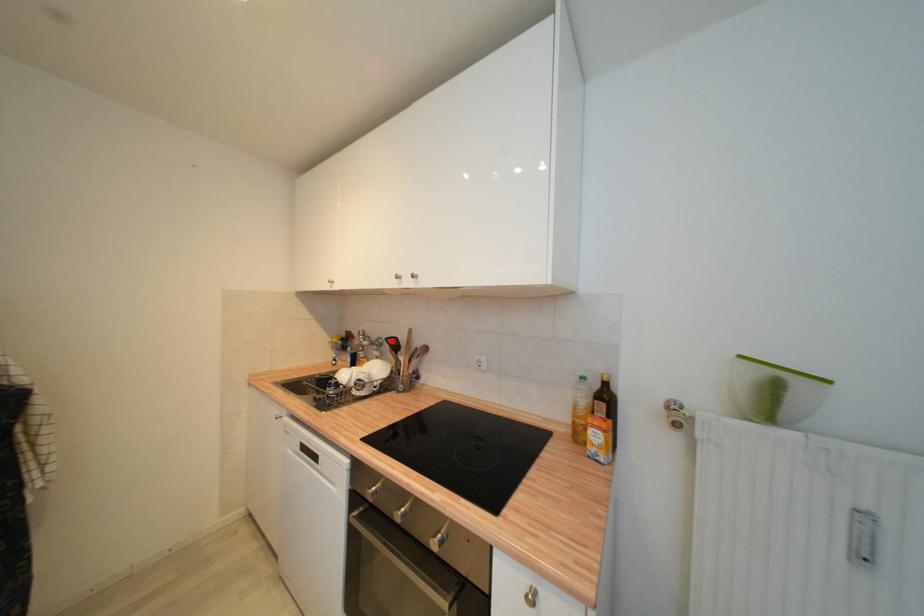
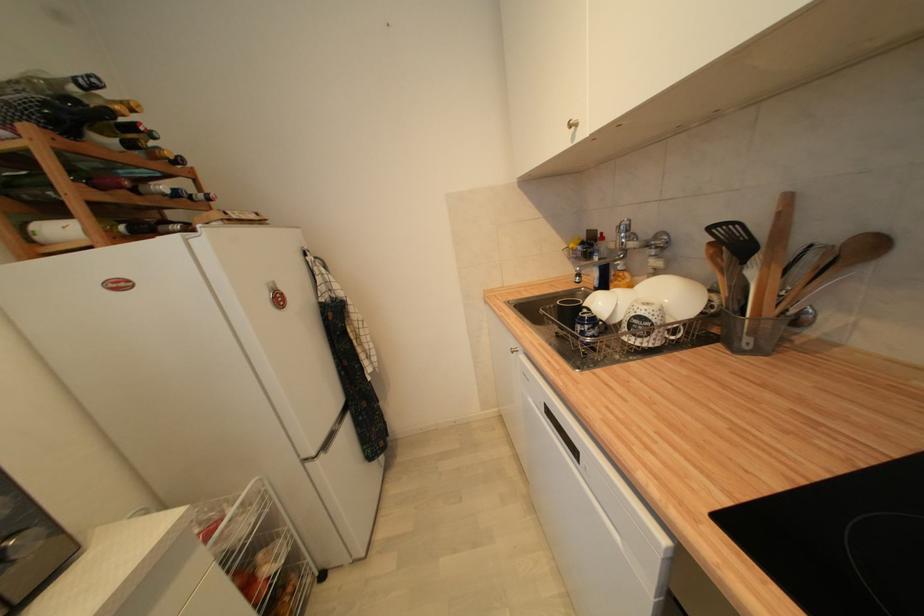
Question: I am providing you with two images of the same scene from different viewpoints. A red point is marked on the first image. At the location where the point appears in image 1, is it still visible in image 2?

Choices:
 (A) Yes
 (B) No

Answer: (A)